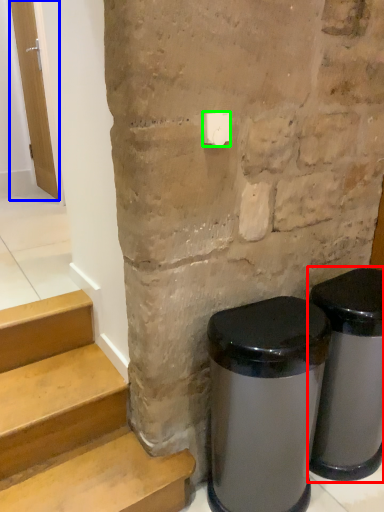
Question: Which is nearer to the waste container (highlighted by a red box)? door (highlighted by a blue box) or light switch (highlighted by a green box).

Choices:
 (A) door
 (B) light switch

Answer: (B)